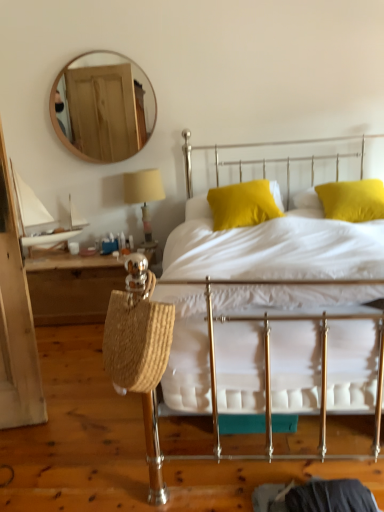
Question: Is yellow fabric pillow at center, which appears as the first pillow when viewed from the left, bigger than woven straw bag at left?

Choices:
 (A) no
 (B) yes

Answer: (A)

Question: Is yellow fabric pillow at center, which is counted as the 2th pillow, starting from the right, surrounding woven straw bag at left?

Choices:
 (A) no
 (B) yes

Answer: (A)

Question: Does yellow fabric pillow at center, which is counted as the 2th pillow, starting from the right, appear on the right side of woven straw bag at left?

Choices:
 (A) no
 (B) yes

Answer: (B)

Question: Is the position of yellow fabric pillow at center, which appears as the first pillow when viewed from the left, less distant than that of woven straw bag at left?

Choices:
 (A) no
 (B) yes

Answer: (B)

Question: Is yellow fabric pillow at center, which is counted as the 2th pillow, starting from the right, positioned with its back to woven straw bag at left?

Choices:
 (A) no
 (B) yes

Answer: (A)

Question: Based on their positions, is wooden round mirror at upper left located to the left or right of woven straw bag at left?

Choices:
 (A) right
 (B) left

Answer: (A)

Question: From a real-world perspective, relative to woven straw bag at left, is wooden round mirror at upper left vertically above or below?

Choices:
 (A) above
 (B) below

Answer: (A)

Question: In terms of height, does wooden round mirror at upper left look taller or shorter compared to woven straw bag at left?

Choices:
 (A) tall
 (B) short

Answer: (A)

Question: Is point (102, 106) positioned closer to the camera than point (39, 279)?

Choices:
 (A) closer
 (B) farther

Answer: (B)

Question: Considering their positions, is white cotton bed at center located in front of or behind woven straw bag at left?

Choices:
 (A) front
 (B) behind

Answer: (A)

Question: Is white cotton bed at center bigger or smaller than woven straw bag at left?

Choices:
 (A) big
 (B) small

Answer: (A)

Question: Considering the positions of point [x=230, y=411] and point [x=54, y=272], is point [x=230, y=411] closer or farther from the camera than point [x=54, y=272]?

Choices:
 (A) farther
 (B) closer

Answer: (B)

Question: Looking at their shapes, would you say white cotton bed at center is wider or thinner than woven straw bag at left?

Choices:
 (A) thin
 (B) wide

Answer: (B)

Question: In the image, is beige fabric lampshade at upper center on the left side or the right side of white cotton bed at center?

Choices:
 (A) left
 (B) right

Answer: (A)

Question: Considering the positions of beige fabric lampshade at upper center and white cotton bed at center in the image, is beige fabric lampshade at upper center taller or shorter than white cotton bed at center?

Choices:
 (A) tall
 (B) short

Answer: (B)